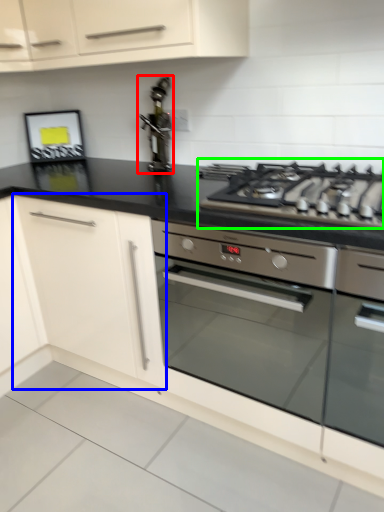
Question: Based on their relative distances, which object is nearer to stainless steel (highlighted by a red box)? Choose from cabinetry (highlighted by a blue box) and gas stove (highlighted by a green box).

Choices:
 (A) cabinetry
 (B) gas stove

Answer: (A)